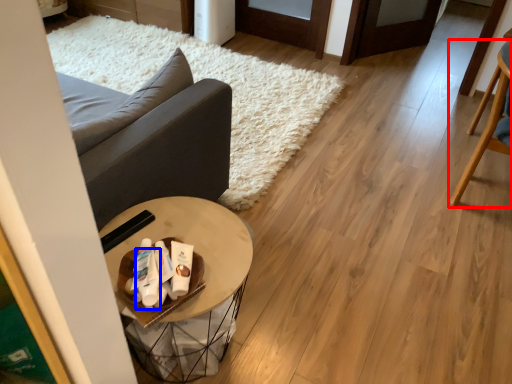
Question: Which object is closer to the camera taking this photo, chair (highlighted by a red box) or toiletry (highlighted by a blue box)?

Choices:
 (A) chair
 (B) toiletry

Answer: (B)